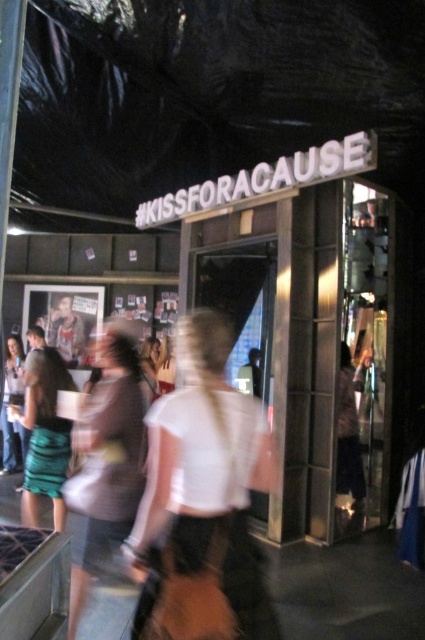
Is green satin dress at left to the left of dark gray sweater at center from the viewer's perspective?

Correct, you'll find green satin dress at left to the left of dark gray sweater at center.

Between green satin dress at left and dark gray sweater at center, which one is positioned lower?

Positioned lower is dark gray sweater at center.

Is point (34, 422) farther from viewer compared to point (345, 442)?

That is False.

What are the coordinates of `green satin dress at left` in the screenshot? It's located at (45, 435).

Is white matte shirt at center closer to the viewer compared to white cotton shirt at center?

Yes, it is in front of white cotton shirt at center.

What do you see at coordinates (204, 486) in the screenshot? Image resolution: width=425 pixels, height=640 pixels. I see `white matte shirt at center` at bounding box center [204, 486].

The width and height of the screenshot is (425, 640). In order to click on white matte shirt at center in this screenshot , I will do `click(204, 486)`.

Is white cotton shirt at center further to camera compared to dark gray sweater at center?

No.

Describe the element at coordinates (104, 464) in the screenshot. The image size is (425, 640). I see `white cotton shirt at center` at that location.

The height and width of the screenshot is (640, 425). In order to click on white cotton shirt at center in this screenshot , I will do `click(104, 464)`.